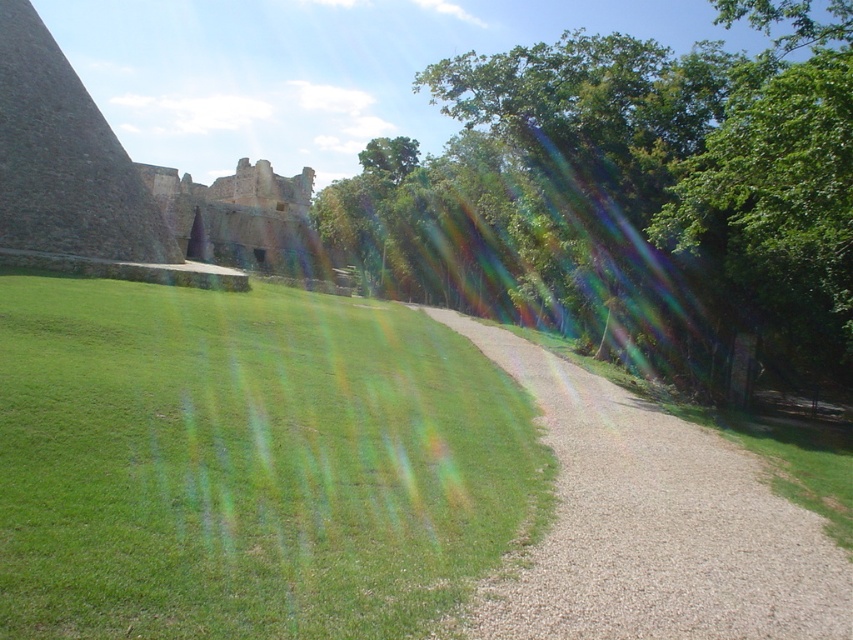
Does green grassy at lower left have a lesser height compared to gravelly dirt path at center?

No, green grassy at lower left is not shorter than gravelly dirt path at center.

Where is `green grassy at lower left`? The height and width of the screenshot is (640, 853). green grassy at lower left is located at coordinates (247, 464).

Image resolution: width=853 pixels, height=640 pixels. What are the coordinates of `green grassy at lower left` in the screenshot? It's located at point(247,464).

Does green grassy at lower left have a greater height compared to stone wall at upper left?

In fact, green grassy at lower left may be shorter than stone wall at upper left.

Between green grassy at lower left and stone wall at upper left, which one appears on the right side from the viewer's perspective?

Positioned to the right is green grassy at lower left.

What do you see at coordinates (247, 464) in the screenshot? I see `green grassy at lower left` at bounding box center [247, 464].

At what (x,y) coordinates should I click in order to perform the action: click on green grassy at lower left. Please return your answer as a coordinate pair (x, y). The height and width of the screenshot is (640, 853). Looking at the image, I should click on (247, 464).

Between green leafy tree at center and stone wall at upper left, which one has less height?

stone wall at upper left

Between green leafy tree at center and stone wall at upper left, which one appears on the left side from the viewer's perspective?

From the viewer's perspective, stone wall at upper left appears more on the left side.

You are a GUI agent. You are given a task and a screenshot of the screen. Output one action in this format:
    pyautogui.click(x=<x>, y=<y>)
    Task: Click on the green leafy tree at center
    The width and height of the screenshot is (853, 640).
    Given the screenshot: What is the action you would take?
    pyautogui.click(x=635, y=196)

Locate an element on the screen. green leafy tree at center is located at coordinates point(635,196).